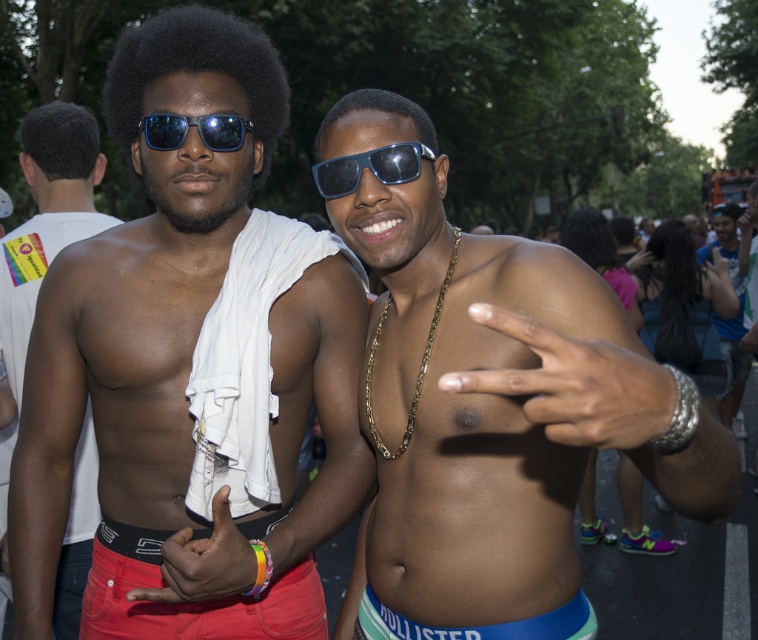
Question: Can you confirm if matte red underwear at lower left is smaller than black matte afro at center?

Choices:
 (A) no
 (B) yes

Answer: (B)

Question: Observing the image, what is the correct spatial positioning of black matte afro at upper left in reference to blue fabric at lower center?

Choices:
 (A) left
 (B) right

Answer: (A)

Question: Is matte red underwear at lower left positioned in front of dark curly hair at upper left?

Choices:
 (A) no
 (B) yes

Answer: (B)

Question: Which point appears closest to the camera in this image?

Choices:
 (A) (63, 173)
 (B) (331, 416)

Answer: (B)

Question: Which is nearer to the white fabric at left?

Choices:
 (A) shiny reflective sunglasses at upper center
 (B) blue fabric at lower center

Answer: (A)

Question: Which object appears farthest from the camera in this image?

Choices:
 (A) shiny reflective sunglasses at upper center
 (B) black matte afro at center
 (C) blue denim shorts at center
 (D) white fabric at left

Answer: (C)